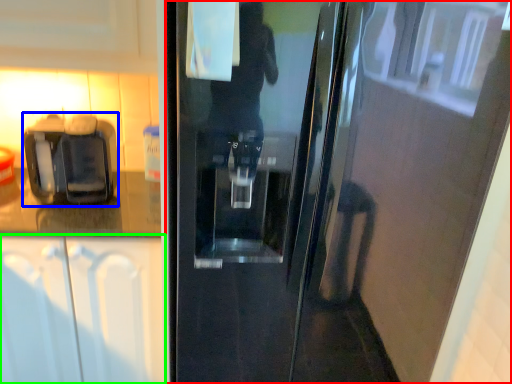
Question: Which is nearer to the door (highlighted by a red box)? coffee machine (highlighted by a blue box) or cabinetry (highlighted by a green box).

Choices:
 (A) coffee machine
 (B) cabinetry

Answer: (B)